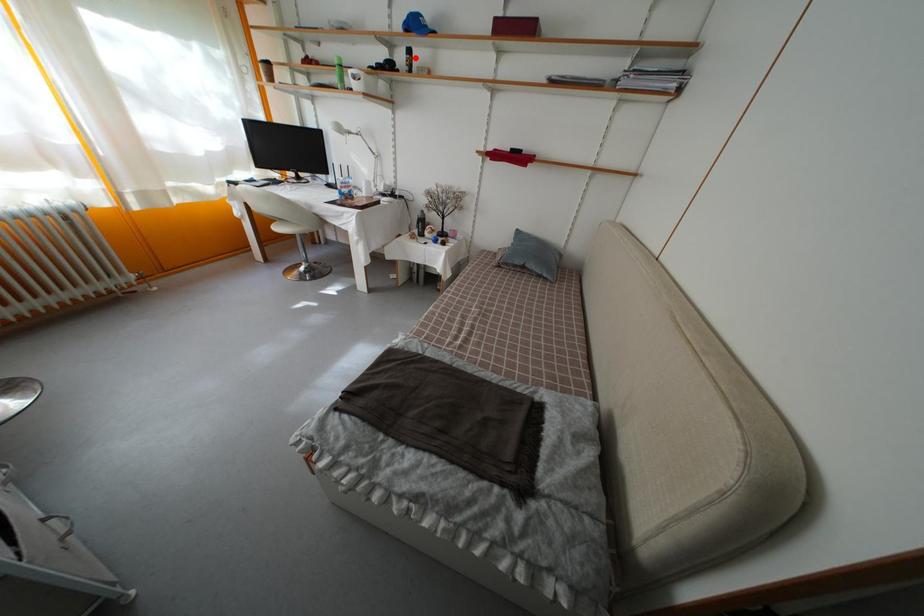
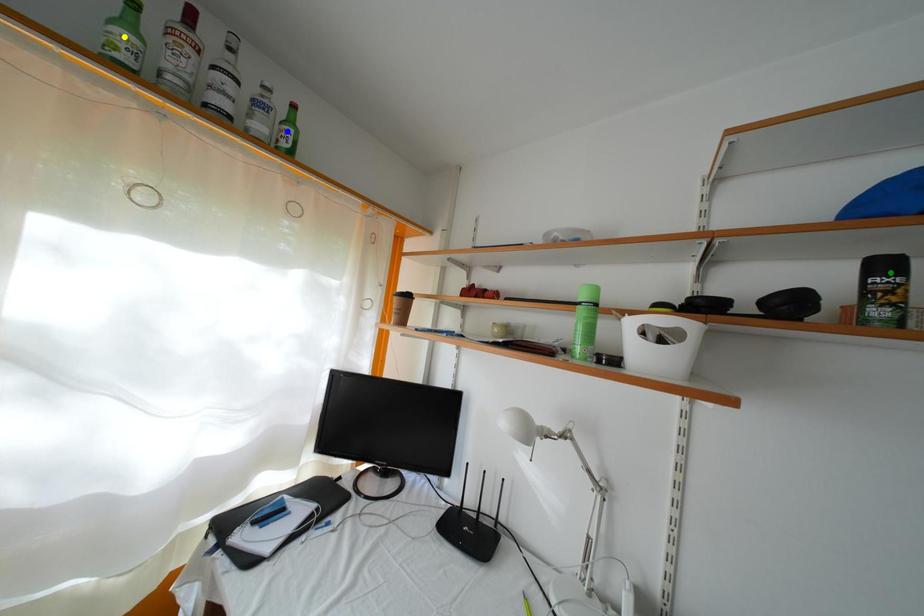
Question: I am providing you with two images of the same scene from different viewpoints. A red point is marked on the first image. You are given multiple points on the second image. Can you choose the point in image 2 that corresponds to the point in image 1?

Choices:
 (A) yellow point
 (B) blue point
 (C) green point

Answer: (C)